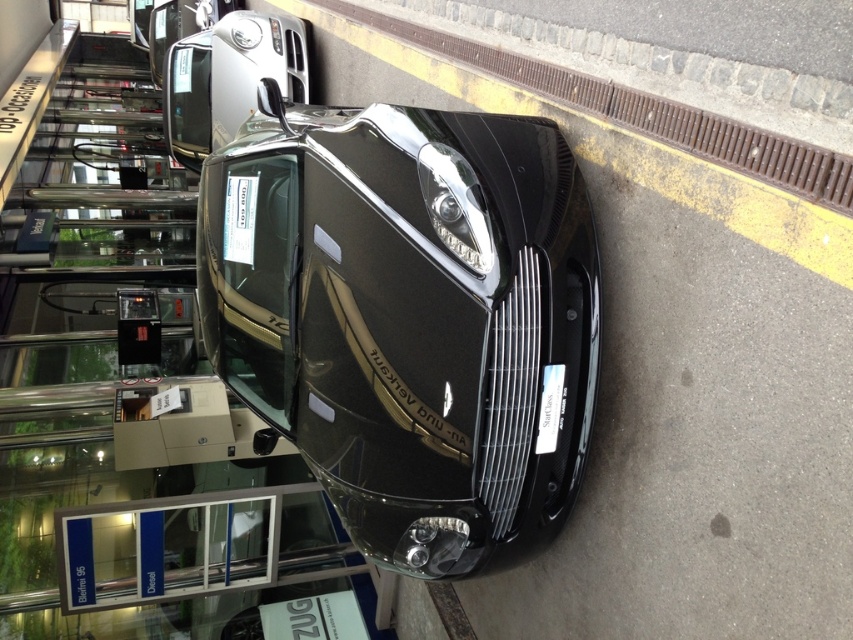
You are a delivery person trying to park a van that is 2 meters wide. You need to park it in the same spot where the glossy black car at center is currently parked. Based on the scene, can the van fit in that parking spot?

The glossy black car at center is located at point (409, 317), which does not provide information about the parking spot dimensions. Therefore, it is unclear if the van can fit there.

You are a delivery person trying to park your van between the glossy black car at center and the satin silver car at upper center. Considering the size difference, which car should you position your van closer to for maximum space?

The glossy black car at center is larger than the satin silver car at upper center, so positioning the van closer to the satin silver car at upper center would provide more space for maneuvering.

Consider the image. You are a delivery person needing to park a large truck between the glossy black car at center and the satin silver car at upper center. Can the truck fit in the space between them based on their widths?

The glossy black car at center is wider than the satin silver car at upper center. Therefore, the space between them may not be wide enough to accommodate a large truck, as the total available width depends on their combined widths and positioning.